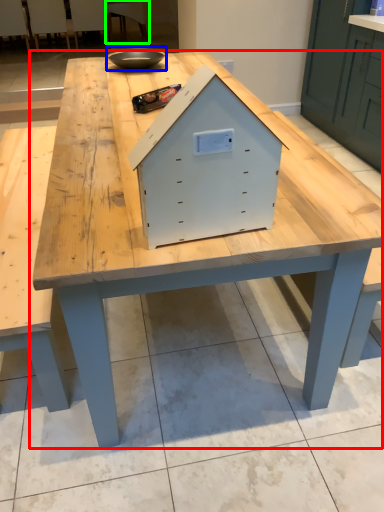
Question: Which is farther away from table (highlighted by a red box)? bowl (highlighted by a blue box) or chair (highlighted by a green box)?

Choices:
 (A) bowl
 (B) chair

Answer: (B)